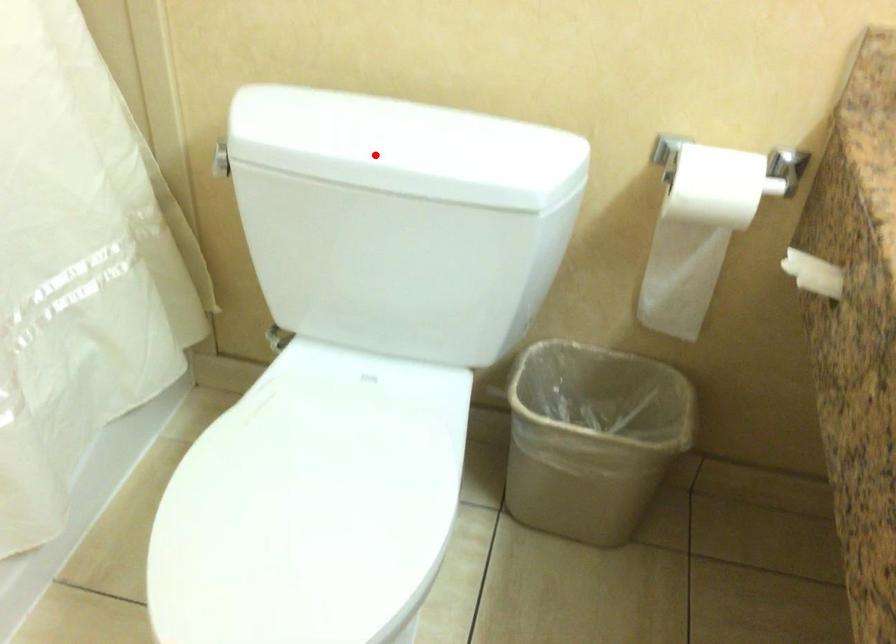
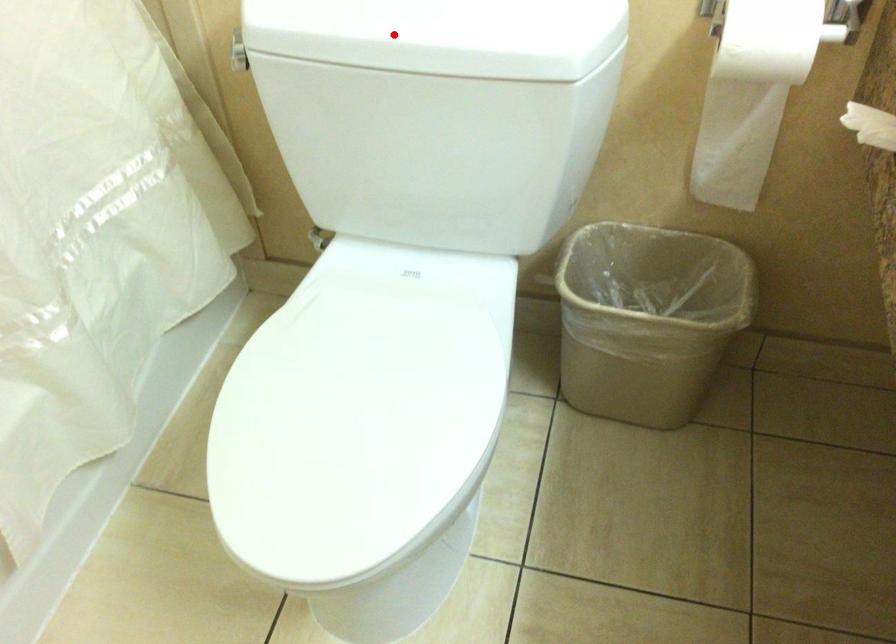
I am providing you with two images of the same scene from different viewpoints. A red point is marked on the first image and another point is marked on the second image. Do the highlighted points in image1 and image2 indicate the same real-world spot?

Yes